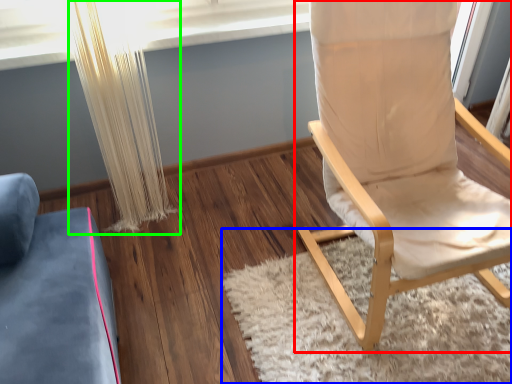
Question: Based on their relative distances, which object is nearer to chair (highlighted by a red box)? Choose from mat (highlighted by a blue box) and curtain (highlighted by a green box).

Choices:
 (A) mat
 (B) curtain

Answer: (A)